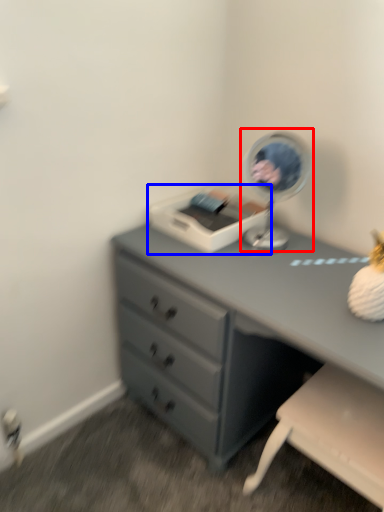
Question: Which of the following is the farthest to the observer, table lamp (highlighted by a red box) or printer (highlighted by a blue box)?

Choices:
 (A) table lamp
 (B) printer

Answer: (B)